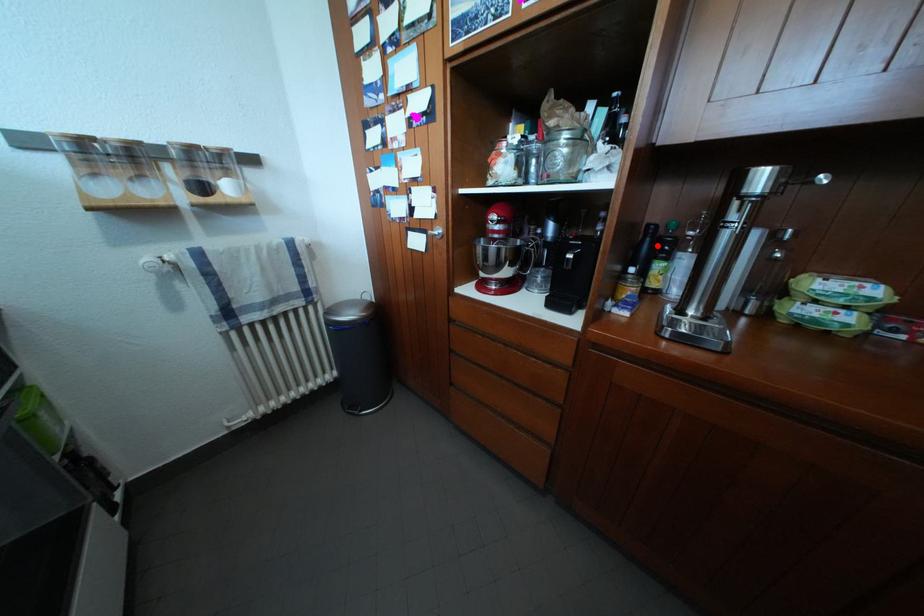
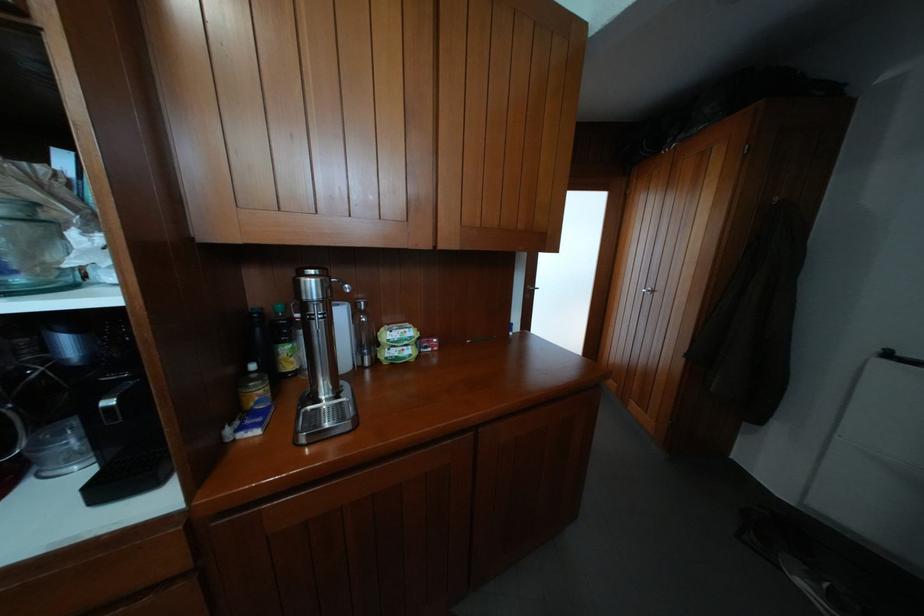
Find the pixel in the second image that matches the highlighted location in the first image.

(266, 334)